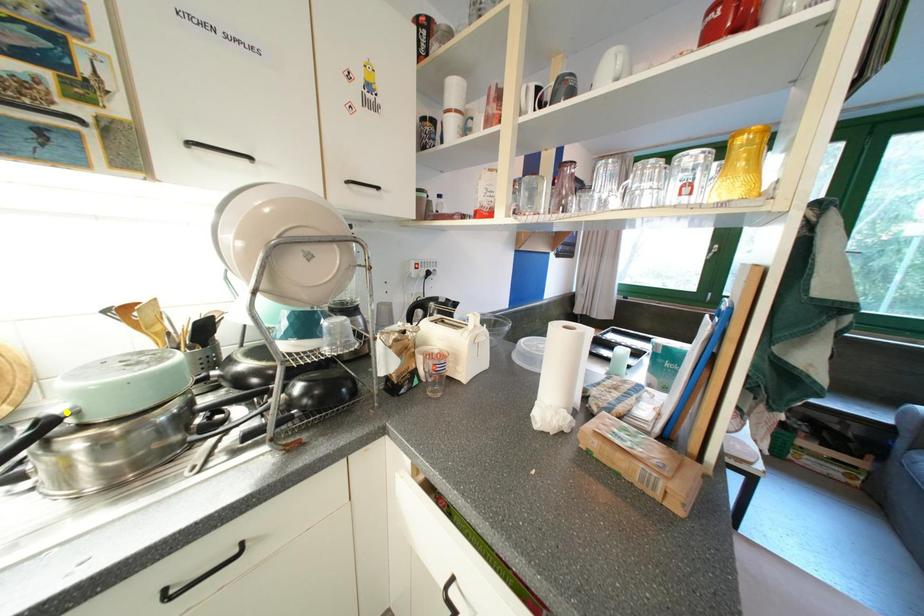
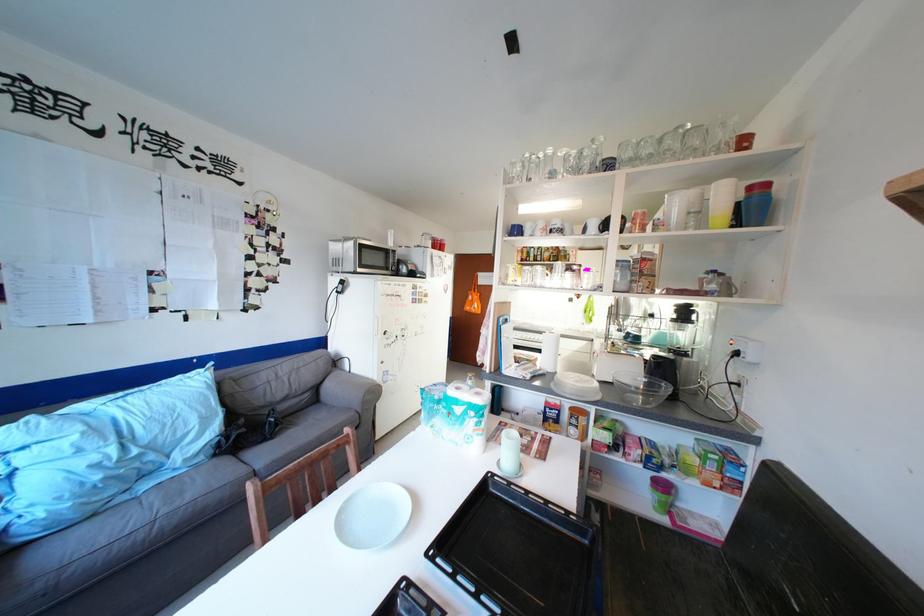
I am providing you with two images of the same scene from different viewpoints. Three points are marked in image1. Which point corresponds to a part or object that is occluded in image2?In image1, three points are marked. Which of them correspond to a part or object that is occluded in image2?Among the three points shown in image1, which one corresponds to a part or object that is no longer visible due to occlusion in image2?

blue point, green point, yellow point cannot be seen in image2.